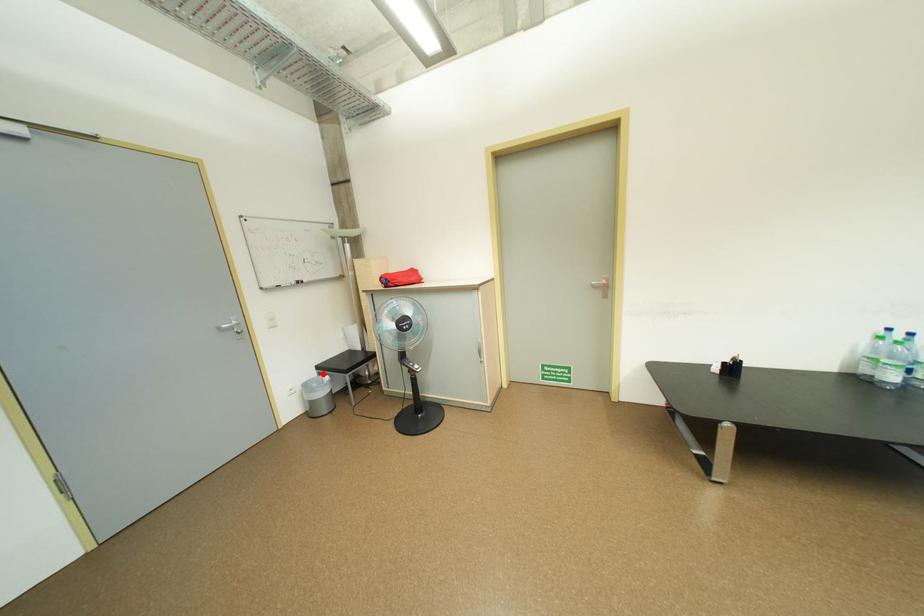
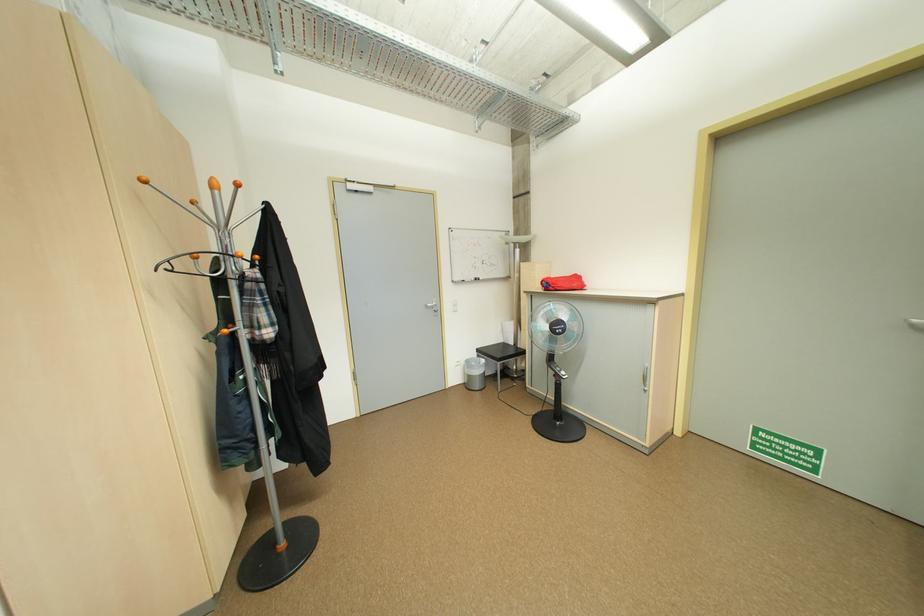
Where in the second image is the point corresponding to the highlighted location from the first image?

(483, 355)